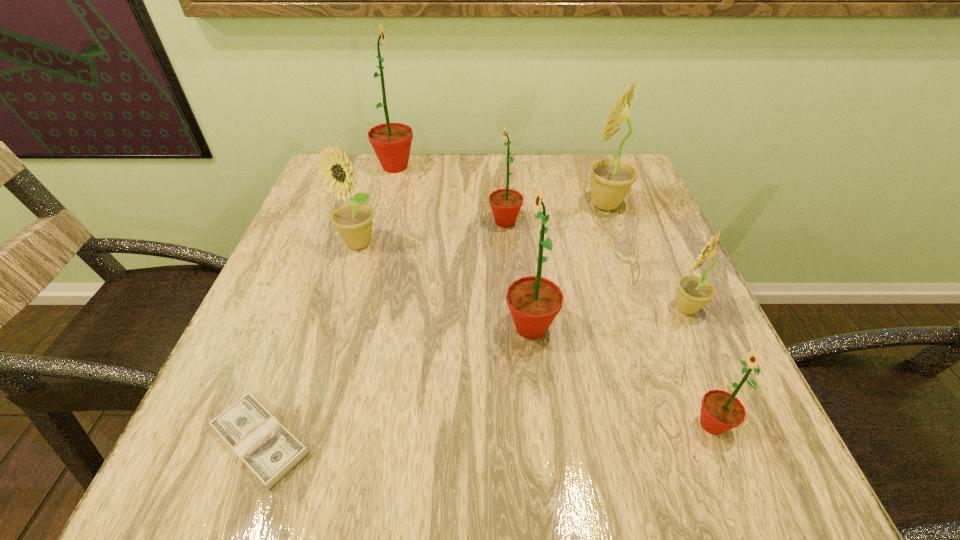
Locate which object is the fourth closest to the biggest green sunflower. Please provide its 2D coordinates. Your answer should be formatted as a tuple, i.e. [(x, y)], where the tuple contains the x and y coordinates of a point satisfying the conditions above.

[(534, 301)]

Locate which sunflower is the closest to the second nearest green sunflower. Please provide its 2D coordinates. Your answer should be formatted as a tuple, i.e. [(x, y)], where the tuple contains the x and y coordinates of a point satisfying the conditions above.

[(721, 411)]

Select which sunflower is the sixth closest to the farthest yellow sunflower. Please provide its 2D coordinates. Your answer should be formatted as a tuple, i.e. [(x, y)], where the tuple contains the x and y coordinates of a point satisfying the conditions above.

[(721, 411)]

The height and width of the screenshot is (540, 960). I want to click on green sunflower that stands as the closest to the leftmost green sunflower, so click(x=505, y=203).

This screenshot has height=540, width=960. What are the coordinates of `the fourth closest green sunflower relative to the shortest object` in the screenshot? It's located at (391, 142).

The height and width of the screenshot is (540, 960). I want to click on yellow sunflower object that ranks as the closest to the smallest yellow sunflower, so click(x=611, y=180).

Locate an element on the screen. The width and height of the screenshot is (960, 540). yellow sunflower identified as the second closest to the farthest sunflower is located at coordinates (611, 180).

Identify the location of free location that satisfies the following two spatial constraints: 1. on the face of the farthest green sunflower; 2. on the front side of the shortest object. The height and width of the screenshot is (540, 960). click(x=322, y=441).

Find the location of a particular element. free space that satisfies the following two spatial constraints: 1. on the face of the farthest yellow sunflower; 2. on the face of the leftmost yellow sunflower is located at coordinates (618, 244).

You are a GUI agent. You are given a task and a screenshot of the screen. Output one action in this format:
    pyautogui.click(x=<x>, y=<y>)
    Task: Click on the free spot that satisfies the following two spatial constraints: 1. on the face of the farthest sunflower; 2. on the face of the second smallest yellow sunflower
    Image resolution: width=960 pixels, height=540 pixels.
    Given the screenshot: What is the action you would take?
    pyautogui.click(x=374, y=244)